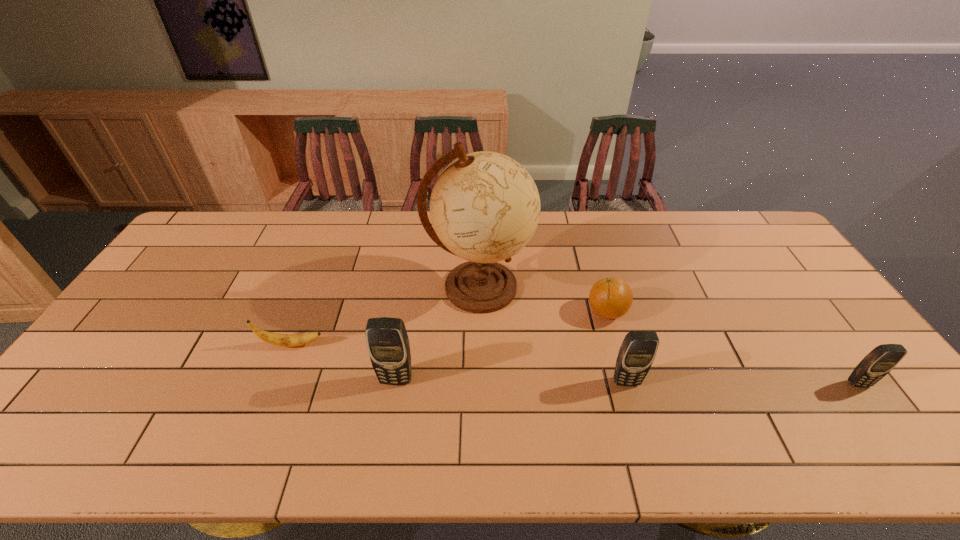
Find the location of `vacant space at the near left corner`. vacant space at the near left corner is located at coordinates (97, 389).

Image resolution: width=960 pixels, height=540 pixels. I want to click on vacant space at the far right corner of the desktop, so click(731, 213).

The width and height of the screenshot is (960, 540). Identify the location of free location at the near right corner of the desktop. (885, 395).

You are a GUI agent. You are given a task and a screenshot of the screen. Output one action in this format:
    pyautogui.click(x=<x>, y=<y>)
    Task: Click on the free space between the leftmost object and the fifth shortest object
    This screenshot has height=540, width=960.
    Given the screenshot: What is the action you would take?
    pyautogui.click(x=344, y=362)

I want to click on unoccupied position between the orange and the globe, so click(543, 299).

Image resolution: width=960 pixels, height=540 pixels. I want to click on free area in between the orange and the tallest object, so click(x=543, y=299).

Locate an element on the screen. The image size is (960, 540). vacant point located between the shortest object and the globe is located at coordinates (385, 316).

This screenshot has width=960, height=540. Identify the location of free space between the orange and the globe. (543, 299).

Locate an element on the screen. The height and width of the screenshot is (540, 960). unoccupied area between the second cellular telephone from left to right and the globe is located at coordinates (553, 334).

The height and width of the screenshot is (540, 960). Identify the location of free spot between the third tallest object and the globe. click(x=553, y=334).